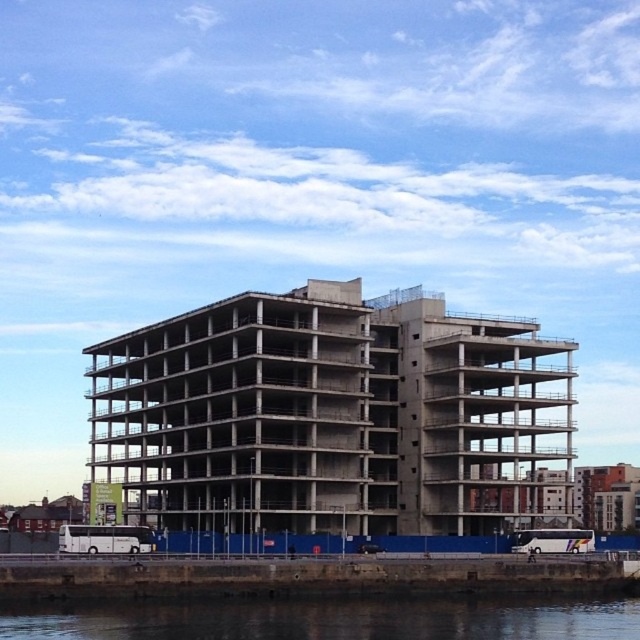
You are a delivery driver who needs to deliver a package to the construction site. You see two points marked on the map. The first point is at coordinate point(308, 348) and the second is at point(8, 630). Which point is closer to the entrance of the construction site?

The point at point(8, 630) is closer to the entrance of the construction site because it is in front of point(308, 348).

You are standing at the construction site entrance and need to locate the concrete building at center. According to the coordinates provided, where should you look relative to your position?

The concrete building at center is located at coordinates point (330, 416), which means it is positioned to the right and slightly above your current viewpoint.

You are a delivery driver who needs to park your truck, which is 10 meters long, near the construction site. The white plastic bus at lower center is already parked there. Can you park your truck next to the concrete building at center without blocking the road?

The concrete building at center is larger than the white plastic bus at lower center. Since the truck is 10 meters long, it might be possible to park it next to the concrete building at center, but you must ensure there is enough space between the building and the road to accommodate the truck without obstructing traffic. The exact feasibility depends on the available space not mentioned here.